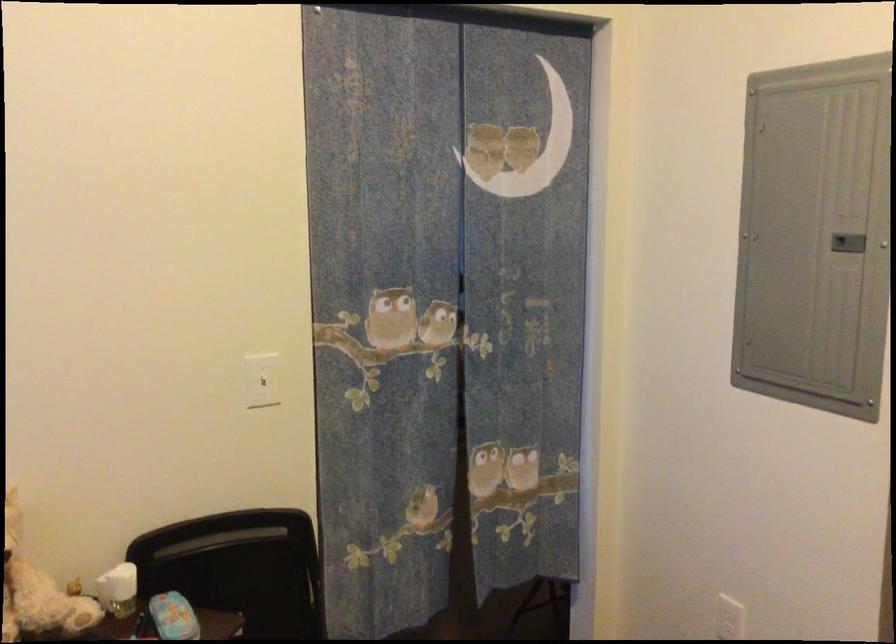
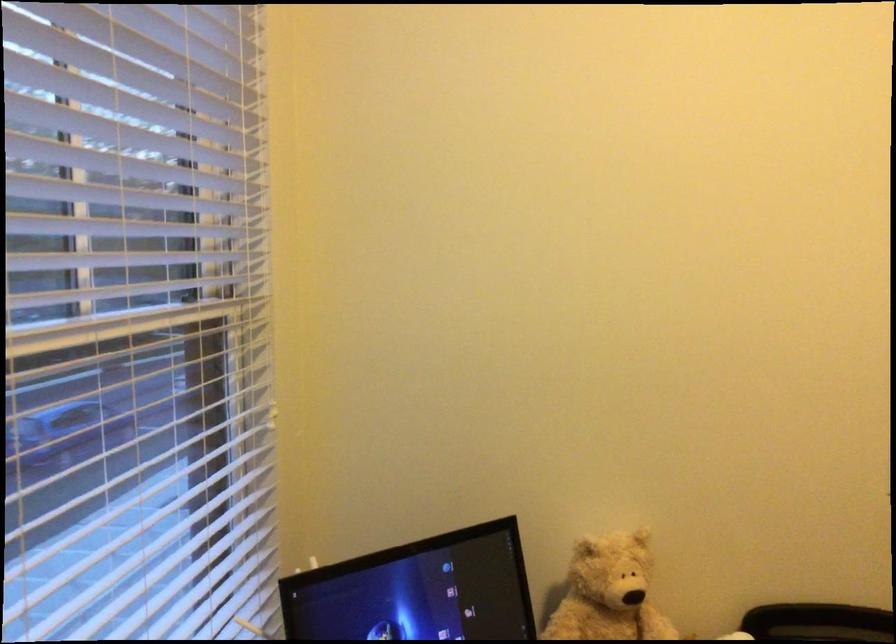
Question: The camera is either moving clockwise (left) or counter-clockwise (right) around the object. The first image is from the beginning of the video and the second image is from the end. Is the camera moving left or right when shooting the video?

Choices:
 (A) Left
 (B) Right

Answer: (B)